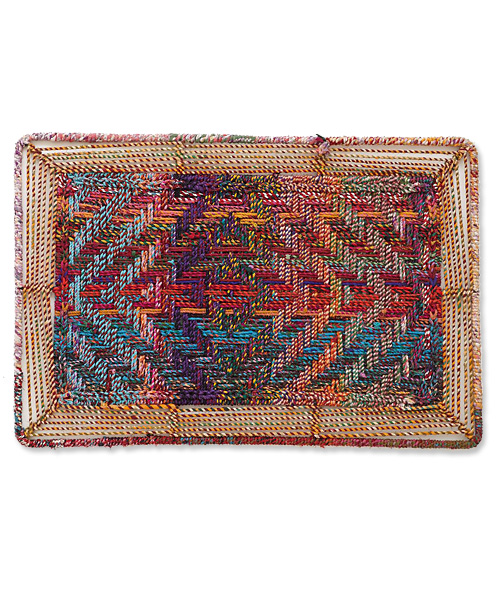
Identify the location of throw rug. (x=255, y=286), (x=187, y=313).